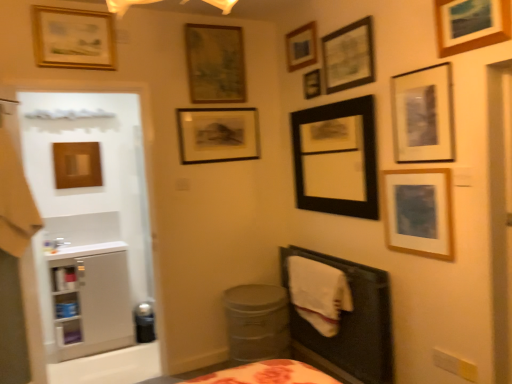
Question: Looking at their shapes, would you say wooden picture frame at upper center, marked as the seventh picture frame in a right-to-left arrangement, is wider or thinner than white soft blanket at lower right?

Choices:
 (A) thin
 (B) wide

Answer: (A)

Question: In the image, is wooden picture frame at upper center, which appears as the fifth picture frame when viewed from the left, positioned in front of or behind white soft blanket at lower right?

Choices:
 (A) behind
 (B) front

Answer: (A)

Question: Considering the real-world distances, which object is closest to the matte black picture frame at upper center, which ranks as the eighth picture frame in left-to-right order?

Choices:
 (A) black matte picture frame at upper center, which is the 7th picture frame from left to right
 (B) wooden picture frame at upper center, acting as the 6th picture frame starting from the right
 (C) metallic gray potty at lower center, the 2th potty when ordered from left to right
 (D) wooden framed print at right, positioned as the second picture frame in right-to-left order
 (E) white matte medicine cabinet at left

Answer: (B)

Question: Which object is positioned farthest from the wooden picture frame at upper center, acting as the 6th picture frame starting from the right?

Choices:
 (A) matte black picture frame at upper right, placed as the ninth picture frame when sorted from left to right
 (B) wooden framed print at right, positioned as the second picture frame in right-to-left order
 (C) wooden picture frame at upper right, which ranks as the 11th picture frame in left-to-right order
 (D) matte black picture frame at upper center, which ranks as the eighth picture frame in left-to-right order
 (E) white soft blanket at lower right

Answer: (E)